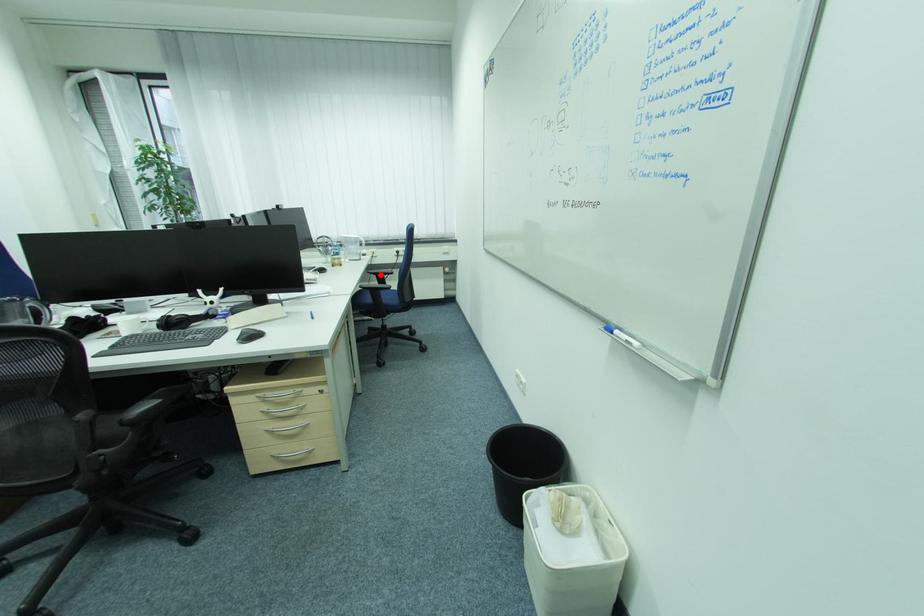
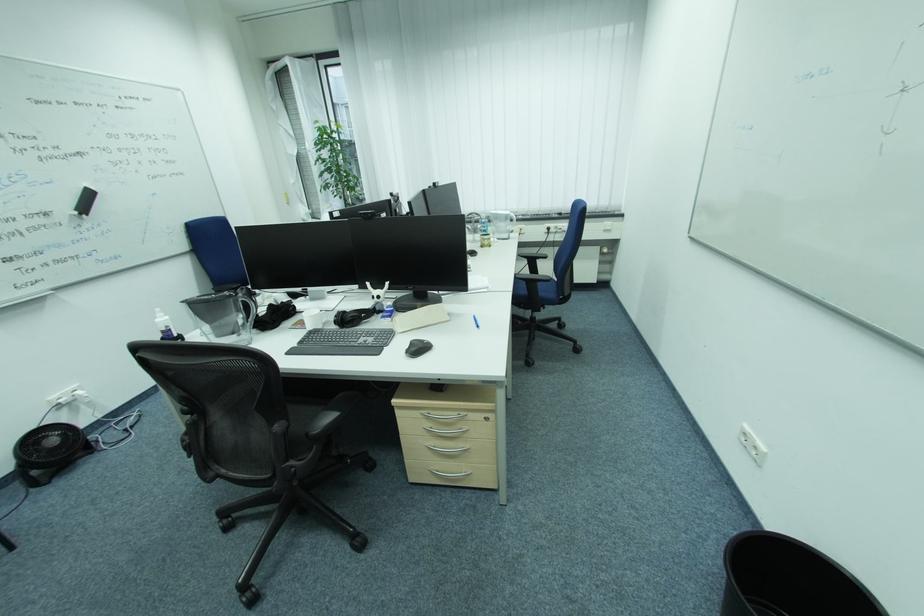
In the second image, find the point that corresponds to the highlighted location in the first image.

(531, 257)